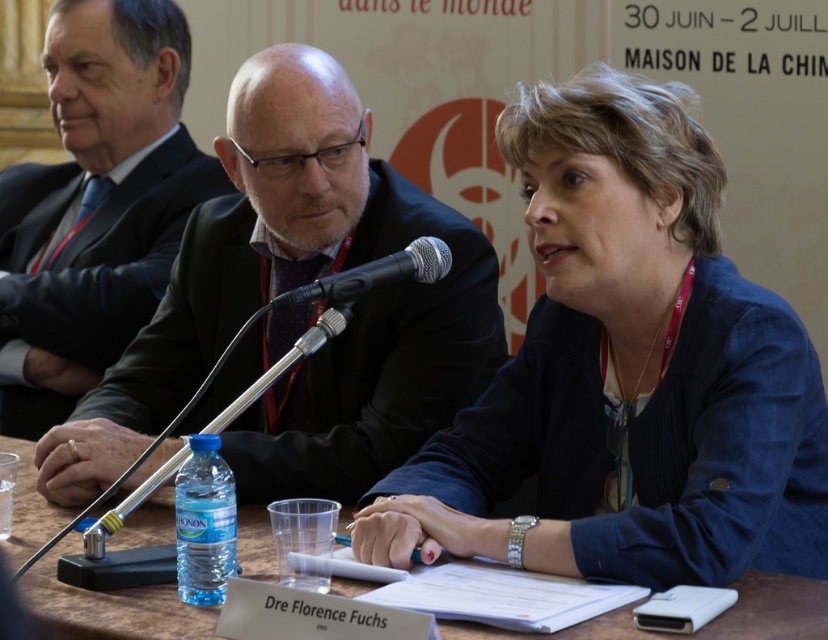
Who is positioned more to the left, blue fabric jacket at center or matte black suit at center?

Positioned to the left is matte black suit at center.

What do you see at coordinates (626, 372) in the screenshot? I see `blue fabric jacket at center` at bounding box center [626, 372].

Locate an element on the screen. The width and height of the screenshot is (828, 640). blue fabric jacket at center is located at coordinates (626, 372).

Image resolution: width=828 pixels, height=640 pixels. What do you see at coordinates (291, 288) in the screenshot?
I see `matte black suit at center` at bounding box center [291, 288].

Consider the image. Is matte black suit at center further to camera compared to brown wooden table at center?

That is True.

Is point (359, 403) positioned after point (273, 568)?

Yes.

This screenshot has height=640, width=828. Find the location of `matte black suit at center`. matte black suit at center is located at coordinates (291, 288).

Measure the distance from brown wooden table at center to black metallic microphone at center.

brown wooden table at center is 19.22 inches away from black metallic microphone at center.

Does point (752, 589) come closer to viewer compared to point (436, 257)?

Yes, it is.

Find the location of a particular element. The image size is (828, 640). brown wooden table at center is located at coordinates (109, 605).